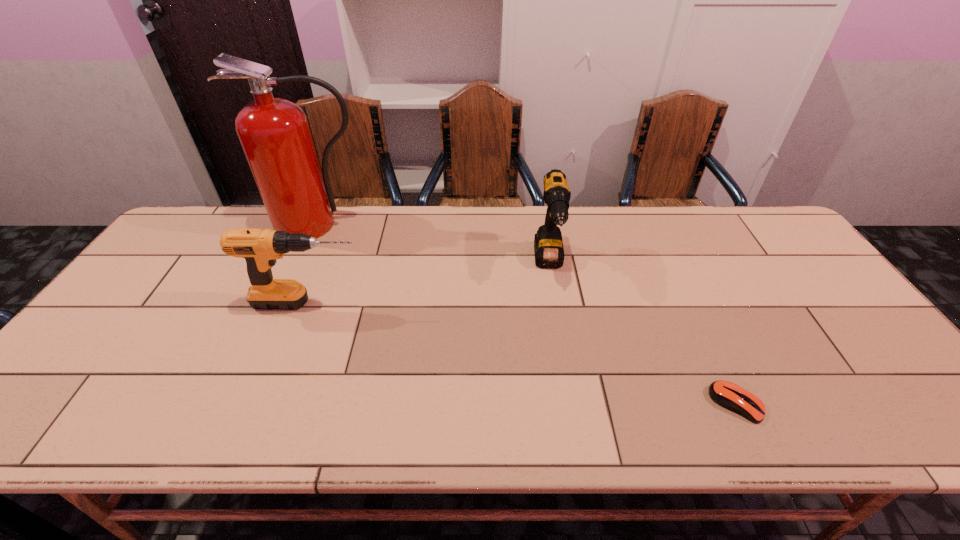
The width and height of the screenshot is (960, 540). What are the coordinates of `vacant space located on the left of the rightmost object` in the screenshot? It's located at (680, 403).

Where is `fire extinguisher present at the far edge`? fire extinguisher present at the far edge is located at coordinates (275, 135).

The height and width of the screenshot is (540, 960). I want to click on drill that is at the far edge, so click(548, 246).

At what (x,y) coordinates should I click in order to perform the action: click on object that is positioned at the near edge. Please return your answer as a coordinate pair (x, y). Looking at the image, I should click on (728, 395).

Find the location of a particular element. The image size is (960, 540). vacant area at the far edge of the desktop is located at coordinates (499, 222).

Where is `free space at the near edge of the desktop`? The height and width of the screenshot is (540, 960). free space at the near edge of the desktop is located at coordinates (701, 414).

At what (x,y) coordinates should I click in order to perform the action: click on free point at the far left corner. Please return your answer as a coordinate pair (x, y). Image resolution: width=960 pixels, height=540 pixels. Looking at the image, I should click on (207, 206).

Image resolution: width=960 pixels, height=540 pixels. I want to click on vacant space at the far right corner of the desktop, so click(x=755, y=244).

Locate an element on the screen. This screenshot has height=540, width=960. free space that is in between the left drill and the nearest object is located at coordinates (522, 353).

Find the location of a particular element. The width and height of the screenshot is (960, 540). unoccupied area between the nearest object and the left drill is located at coordinates (522, 353).